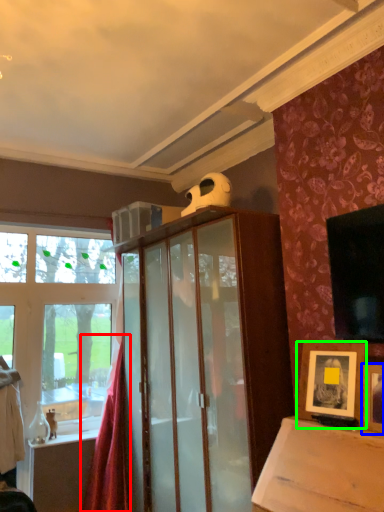
Question: Which object is positioned farthest from curtain (highlighted by a red box)? Select from picture frame (highlighted by a blue box) and picture frame (highlighted by a green box).

Choices:
 (A) picture frame
 (B) picture frame

Answer: (A)